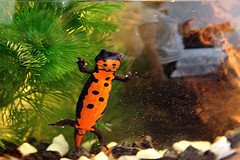
Locate an element on the screen. glass is located at coordinates (151, 98).